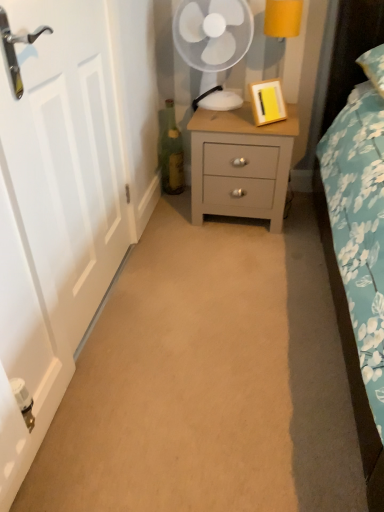
This screenshot has height=512, width=384. Find the location of `vacant space to the left of matte gray nightstand at center`. vacant space to the left of matte gray nightstand at center is located at coordinates (169, 222).